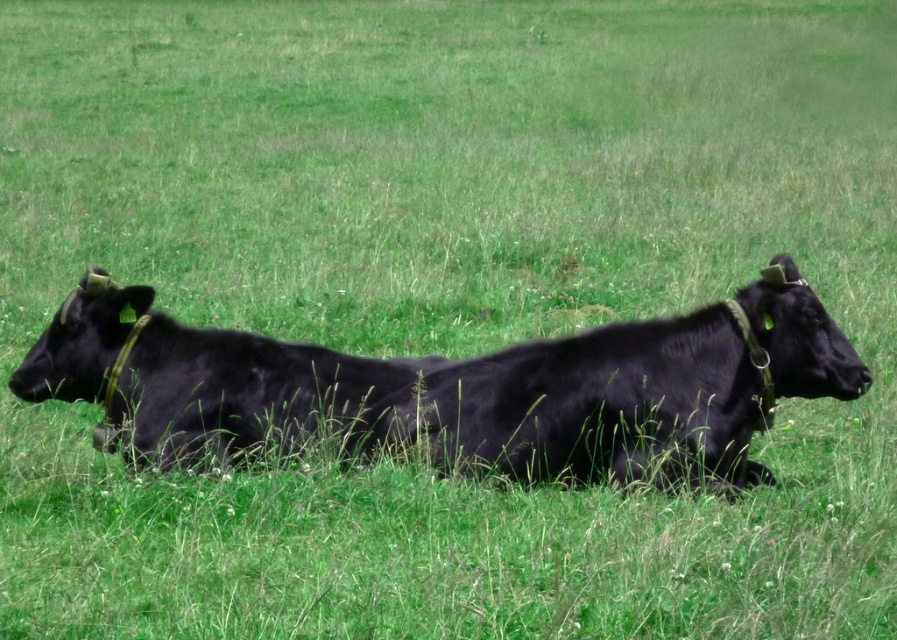
Consider the image. You are a farmer checking the health of your cows. You notice that the black smooth cow at center and the shiny black cow at left are lying down. Which cow is taller?

The black smooth cow at center is taller than the shiny black cow at left.

You are a farmer checking the location of your cows in the field. You have a map that uses coordinate points to mark their positions. According to the map, the black smooth cow at center is located at point (464, 387). Where would you expect to find the black smooth cow at center in the field?

The black smooth cow at center is located at point (464, 387) on the map, so you would find it at that coordinate position in the field.

You are a farmer checking the pasture. You have a fence gate that is 1.5 meters wide. Can both the black smooth cow at center and the shiny black cow at left pass through the gate one at a time?

The black smooth cow at center might be wider than shiny black cow at left. Since the gate is 1.5 meters wide, the shiny black cow at left can pass through, but there is uncertainty if the black smooth cow at center can fit due to its potential greater width.